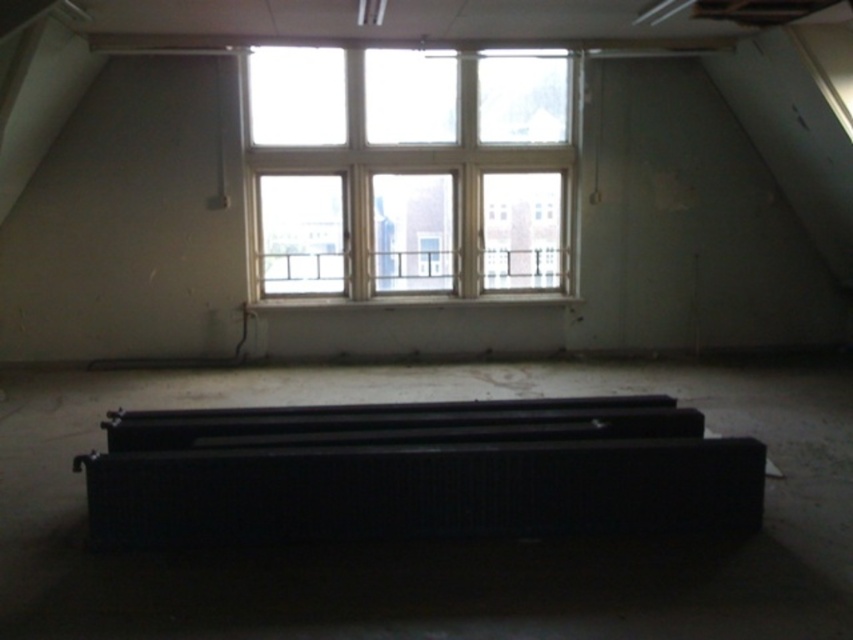
You are standing in the room and want to reach the clear glass window at upper center. There is a black matte radiator at center blocking your path. Can you walk around it to get to the window?

The black matte radiator at center is closer to the viewer than the clear glass window at upper center, so you can walk around it to reach the window.